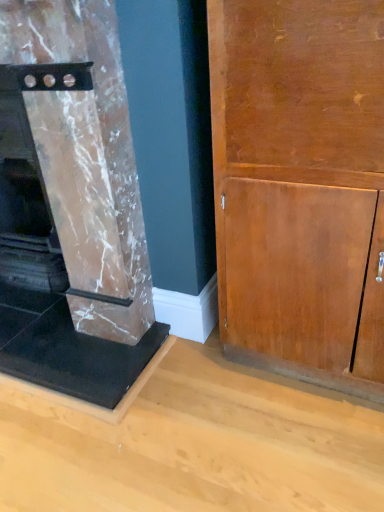
The height and width of the screenshot is (512, 384). Identify the location of free location in front of wooden cabinet at right. (296, 446).